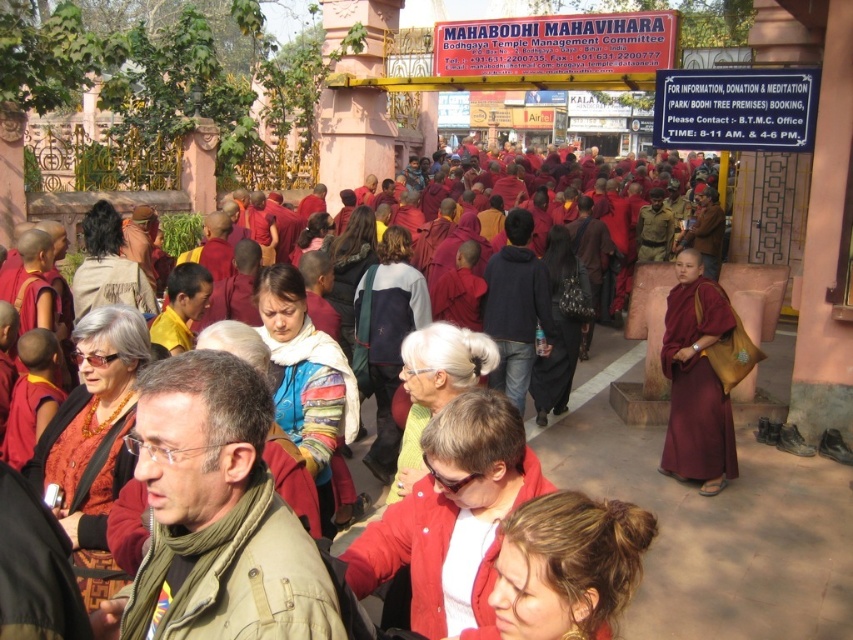
You are a photographer at Mahabodhi Mahavihara temple. You need to capture both the matte maroon robe at center and the maroon silk robe at right in a single frame. Which robe should you focus on to ensure both are visible without zooming in or out?

You should focus on the matte maroon robe at center because its width is larger than the maroon silk robe at right, making it easier to include both in the frame without adjusting the zoom.

From the picture: You are a tourist at Mahabodhi Mahavihara temple and see the matte maroon robe at center and the maroon silk robe at right. Which robe is positioned closer to the entrance signboard mentioned in the scene description?

The matte maroon robe at center is closer to the entrance signboard because it is positioned to the left of the maroon silk robe at right, and the entrance signboard is located above the entrance as described in the scene.